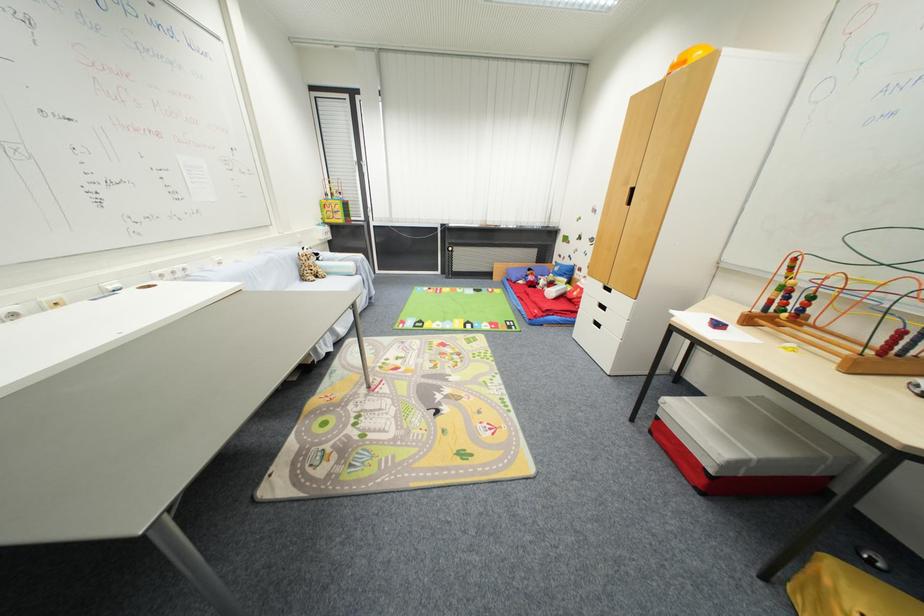
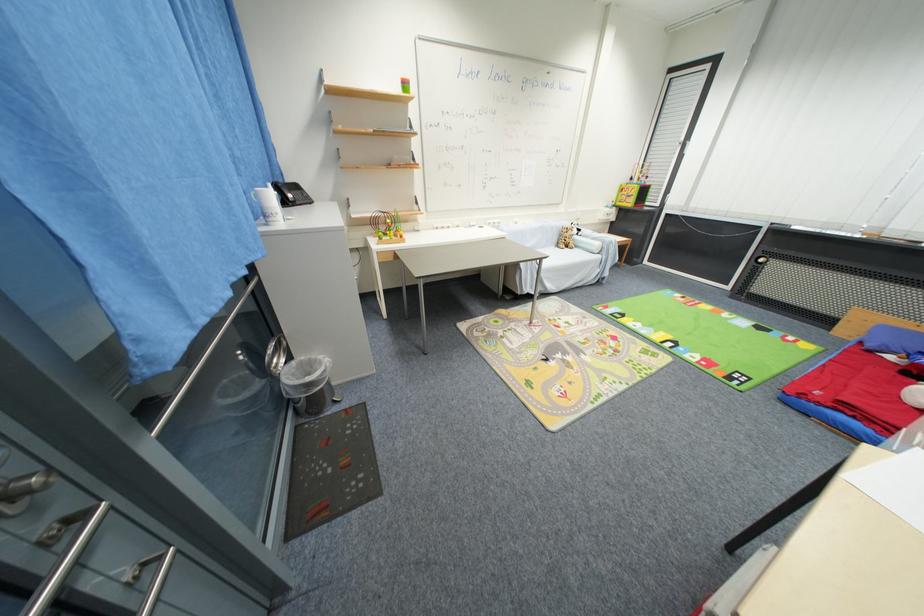
Where in the second image is the point corresponding to (x=548, y=318) from the first image?

(824, 406)